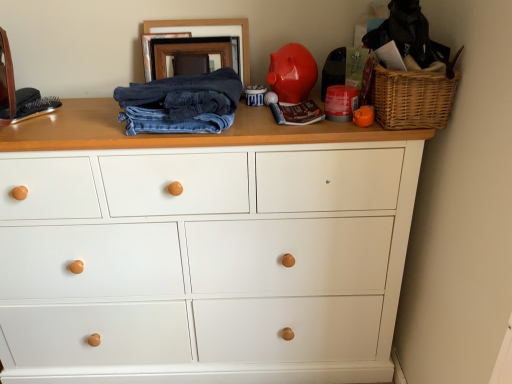
Identify the location of vacant region above dark blue denim jeans at center (from a real-world perspective). (193, 81).